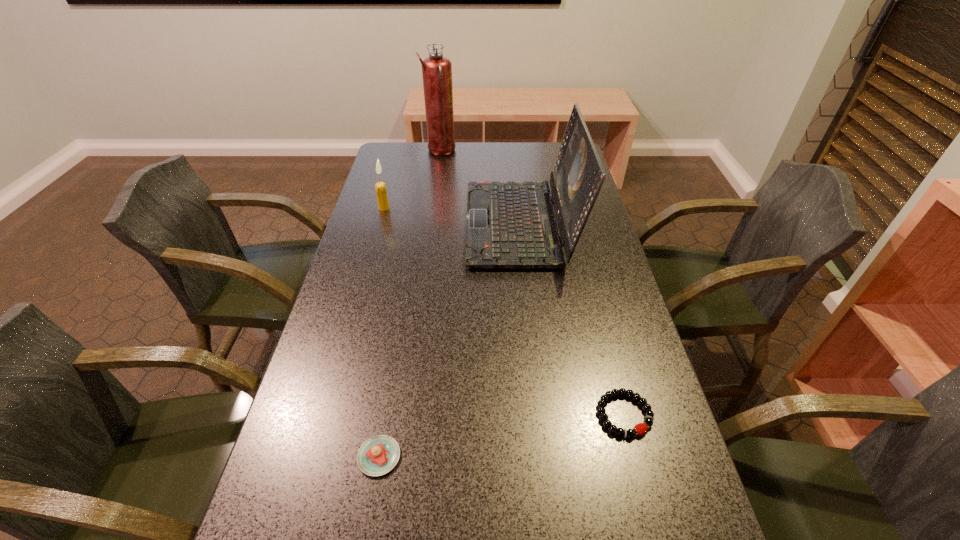
The image size is (960, 540). In order to click on vacant area that lies between the second shortest object and the laptop computer in this screenshot , I will do `click(450, 340)`.

In order to click on free space between the candle and the laptop computer in this screenshot , I will do `click(452, 216)`.

You are a GUI agent. You are given a task and a screenshot of the screen. Output one action in this format:
    pyautogui.click(x=<x>, y=<y>)
    Task: Click on the empty space that is in between the shortest object and the farthest object
    Image resolution: width=960 pixels, height=540 pixels.
    Given the screenshot: What is the action you would take?
    [532, 283]

Locate an element on the screen. The image size is (960, 540). empty location between the laptop computer and the shortest object is located at coordinates (572, 319).

Locate which object is the fourth closest to the third shortest object. Please provide its 2D coordinates. Your answer should be formatted as a tuple, i.e. [(x, y)], where the tuple contains the x and y coordinates of a point satisfying the conditions above.

[(640, 428)]

Locate which object ranks fourth in proximity to the shortest object. Please provide its 2D coordinates. Your answer should be formatted as a tuple, i.e. [(x, y)], where the tuple contains the x and y coordinates of a point satisfying the conditions above.

[(436, 69)]

Identify the location of free space that satisfies the following two spatial constraints: 1. on the side of the farthest object with the label; 2. on the right side of the shortest object. (403, 415).

Identify the location of free spot that satisfies the following two spatial constraints: 1. on the side of the farthest object with the label; 2. on the left side of the bracelet. The height and width of the screenshot is (540, 960). (403, 415).

Find the location of `vacant space that satisfies the following two spatial constraints: 1. on the side of the tallest object with the label; 2. on the right side of the bracelet`. vacant space that satisfies the following two spatial constraints: 1. on the side of the tallest object with the label; 2. on the right side of the bracelet is located at coordinates [403, 415].

Locate an element on the screen. This screenshot has width=960, height=540. blank area in the image that satisfies the following two spatial constraints: 1. on the front side of the leftmost object; 2. on the left side of the fourth tallest object is located at coordinates (315, 456).